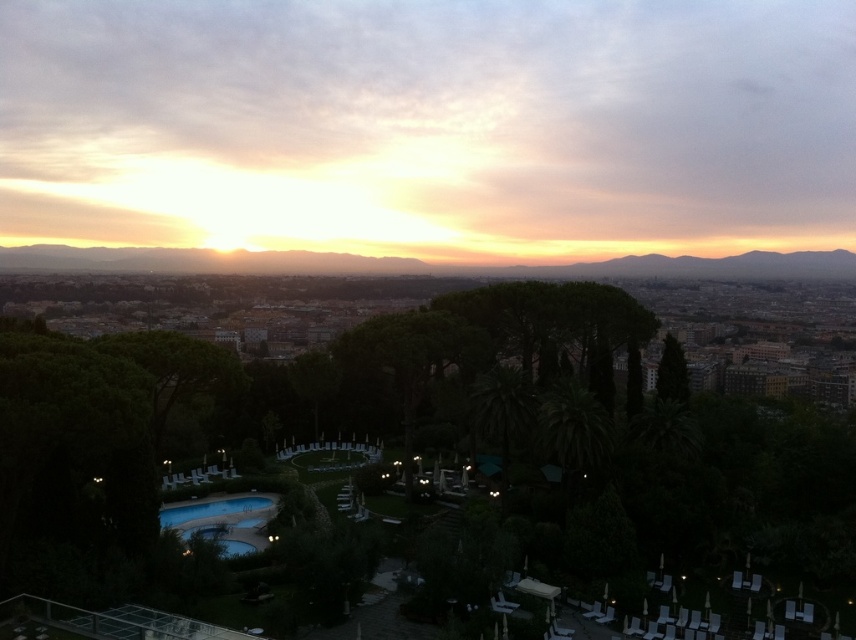
You are standing at the point closer to the camera between the two points, point (664, 260) and point (230, 540). Which point are you standing at?

You are standing at point (664, 260) because it is further to the camera than point (230, 540).

You are a guest at a resort and want to take a photo of the golden sky at center and the blue glass pool at lower left. From where should you stand to ensure both are visible in your camera frame?

You should stand at a position where you can look upward to capture the golden sky at center above the blue glass pool at lower left, ensuring both are within the camera frame.

You are planning to take a photo of the golden sky at center and the blue glass pool at lower left. Which object will occupy more space in your camera frame?

The golden sky at center will occupy more space in the camera frame because its width is larger than that of the blue glass pool at lower left.